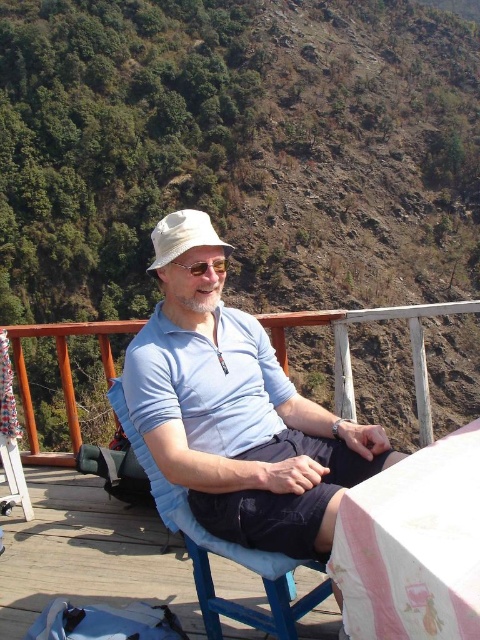
Where is `pink fabric table at lower right`? This screenshot has width=480, height=640. pink fabric table at lower right is located at coordinates (414, 545).

Can you confirm if pink fabric table at lower right is positioned to the right of blue fabric chair at center?

Yes, pink fabric table at lower right is to the right of blue fabric chair at center.

Does point (425, 502) come closer to viewer compared to point (162, 488)?

Yes, point (425, 502) is closer to viewer.

The width and height of the screenshot is (480, 640). In order to click on pink fabric table at lower right in this screenshot , I will do `click(414, 545)`.

Between light blue cotton shirt at center and wooden deck at center, which one appears on the right side from the viewer's perspective?

From the viewer's perspective, light blue cotton shirt at center appears more on the right side.

Does point (286, 508) come behind point (315, 312)?

No.

Which is behind, point (283, 552) or point (70, 394)?

Positioned behind is point (70, 394).

Where is `light blue cotton shirt at center`? This screenshot has width=480, height=640. light blue cotton shirt at center is located at coordinates (237, 410).

Can you confirm if blue fabric chair at center is smaller than matte plastic sunglasses at center?

No, blue fabric chair at center is not smaller than matte plastic sunglasses at center.

Between blue fabric chair at center and matte plastic sunglasses at center, which one has less height?

matte plastic sunglasses at center is shorter.

Is point (127, 422) positioned before point (195, 264)?

That is True.

At what (x,y) coordinates should I click in order to perform the action: click on blue fabric chair at center. Please return your answer as a coordinate pair (x, y). Image resolution: width=480 pixels, height=640 pixels. Looking at the image, I should click on (222, 552).